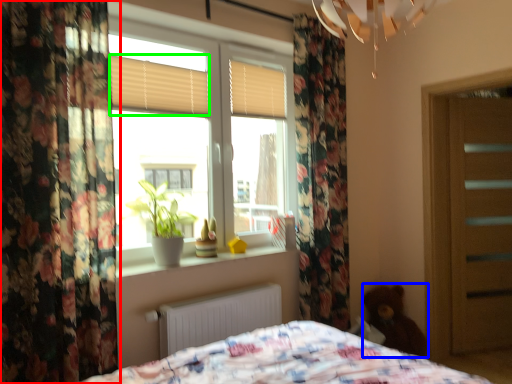
Question: Based on their relative distances, which object is nearer to curtain (highlighted by a red box)? Choose from teddy (highlighted by a blue box) and shutter (highlighted by a green box).

Choices:
 (A) teddy
 (B) shutter

Answer: (B)